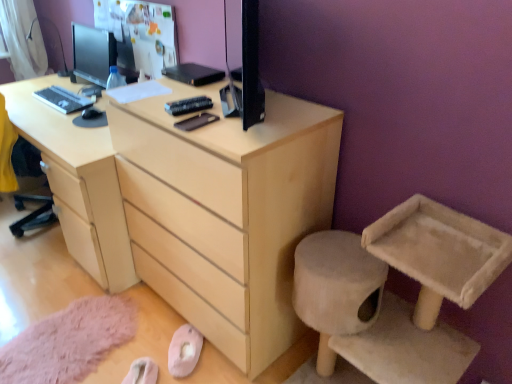
Question: From the image's perspective, is light wood desk at center above matte black monitor at upper left?

Choices:
 (A) yes
 (B) no

Answer: (B)

Question: Is light wood desk at center positioned far away from matte black monitor at upper left?

Choices:
 (A) yes
 (B) no

Answer: (B)

Question: Does light wood desk at center have a greater height compared to matte black monitor at upper left?

Choices:
 (A) no
 (B) yes

Answer: (B)

Question: Considering the relative positions of light wood desk at center and matte black monitor at upper left in the image provided, is light wood desk at center to the left of matte black monitor at upper left from the viewer's perspective?

Choices:
 (A) no
 (B) yes

Answer: (B)

Question: Is light wood desk at center positioned with its back to matte black monitor at upper left?

Choices:
 (A) yes
 (B) no

Answer: (B)

Question: From the image's perspective, does light wood desk at center appear lower than matte black monitor at upper left?

Choices:
 (A) no
 (B) yes

Answer: (B)

Question: Does matte black keyboard at left have a greater height compared to light wood desk at center?

Choices:
 (A) yes
 (B) no

Answer: (B)

Question: Can you see matte black keyboard at left touching light wood desk at center?

Choices:
 (A) no
 (B) yes

Answer: (A)

Question: Does matte black keyboard at left have a lesser height compared to light wood desk at center?

Choices:
 (A) no
 (B) yes

Answer: (B)

Question: Considering the relative positions of matte black keyboard at left and light wood desk at center in the image provided, is matte black keyboard at left to the left of light wood desk at center from the viewer's perspective?

Choices:
 (A) no
 (B) yes

Answer: (B)

Question: Considering the relative sizes of matte black keyboard at left and light wood desk at center in the image provided, is matte black keyboard at left bigger than light wood desk at center?

Choices:
 (A) yes
 (B) no

Answer: (B)

Question: Could you tell me if matte black keyboard at left is facing light wood desk at center?

Choices:
 (A) yes
 (B) no

Answer: (B)

Question: Can you confirm if light wood chest of drawers at center is bigger than beige fabric cat tree at lower right?

Choices:
 (A) yes
 (B) no

Answer: (A)